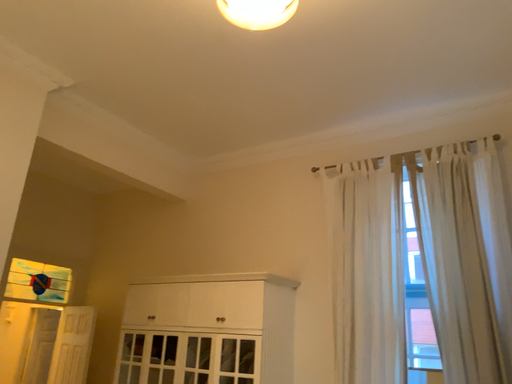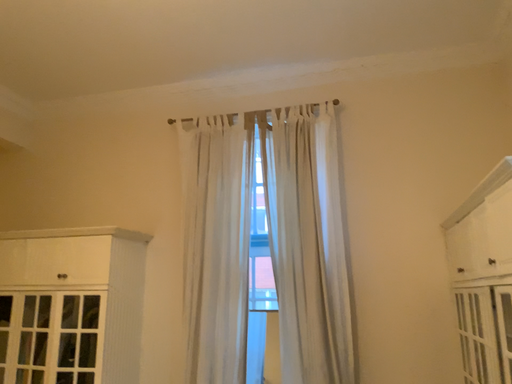
Question: Which way did the camera rotate in the video?

Choices:
 (A) rotated right
 (B) rotated left

Answer: (A)